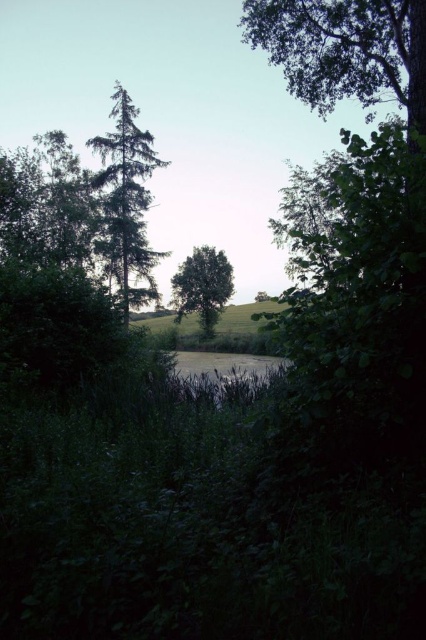
Is green matte tree at center shorter than green leafy tree at center?

No, green matte tree at center is not shorter than green leafy tree at center.

Between point (117, 221) and point (221, 298), which one is positioned behind?

The point (221, 298) is more distant.

Between point (135, 186) and point (198, 292), which one is positioned in front?

Point (135, 186)

Find the location of a particular element. green matte tree at center is located at coordinates (126, 198).